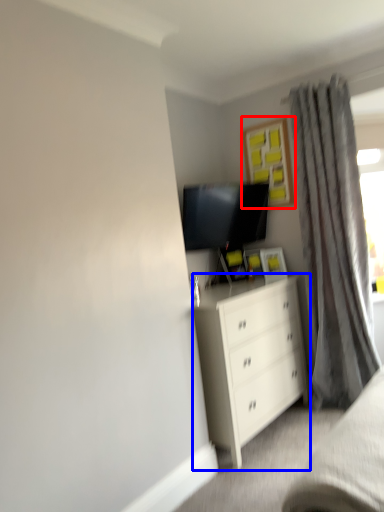
Question: Which of the following is the farthest to the observer, picture frame (highlighted by a red box) or chest of drawers (highlighted by a blue box)?

Choices:
 (A) picture frame
 (B) chest of drawers

Answer: (A)